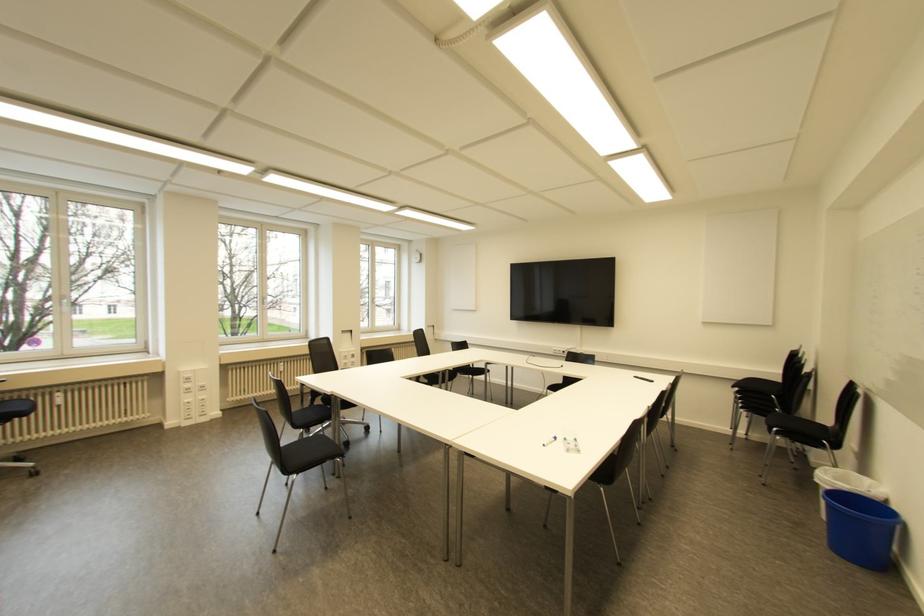
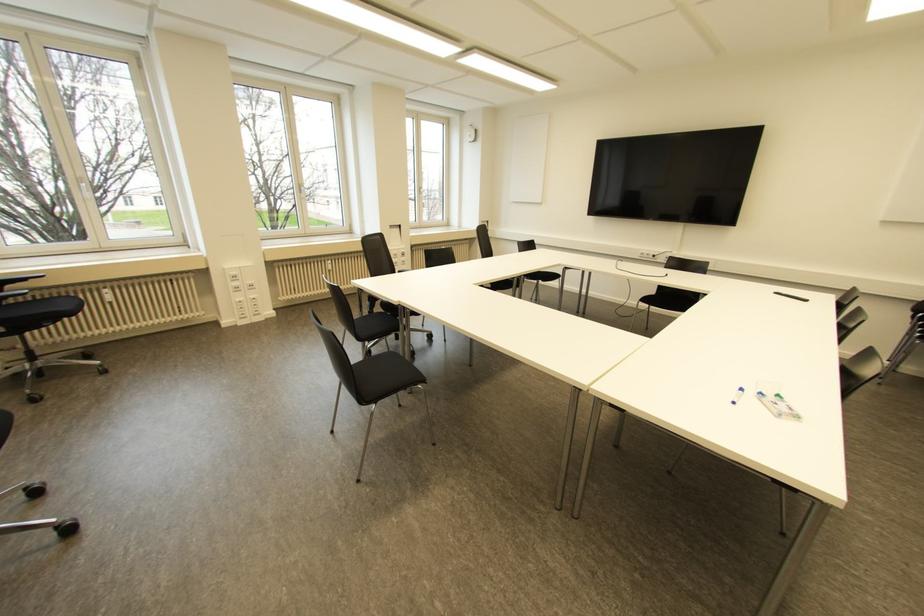
Locate, in the second image, the point that corresponds to the point at 554,438 in the first image.

(739, 390)